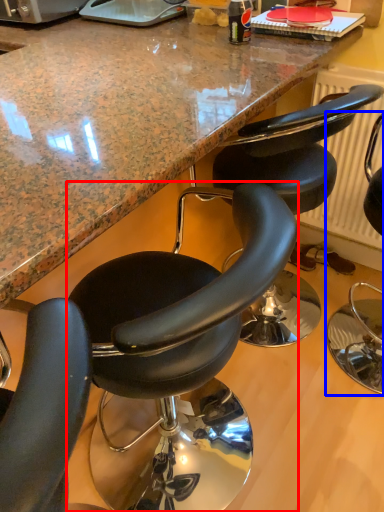
Question: Which point is closer to the camera, chair (highlighted by a red box) or chair (highlighted by a blue box)?

Choices:
 (A) chair
 (B) chair

Answer: (A)